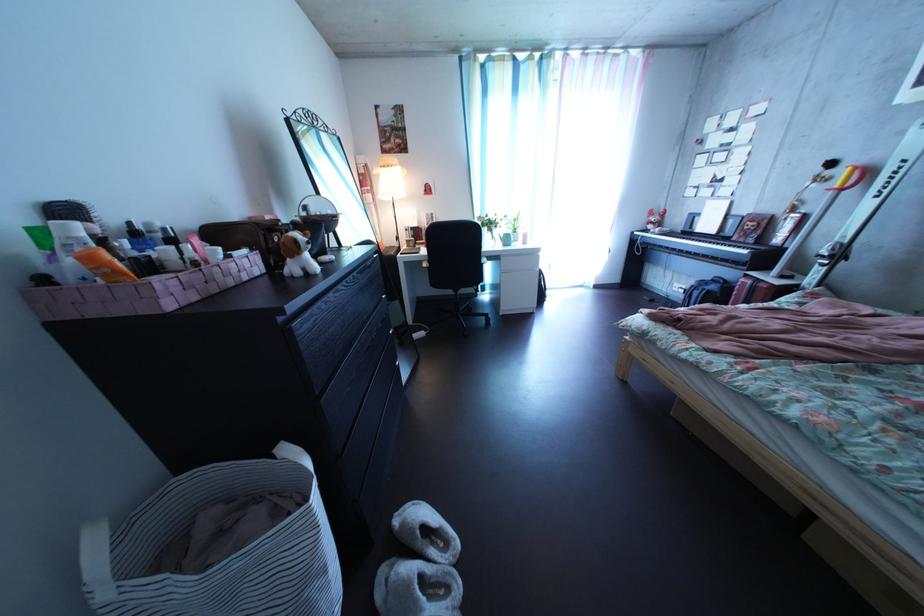
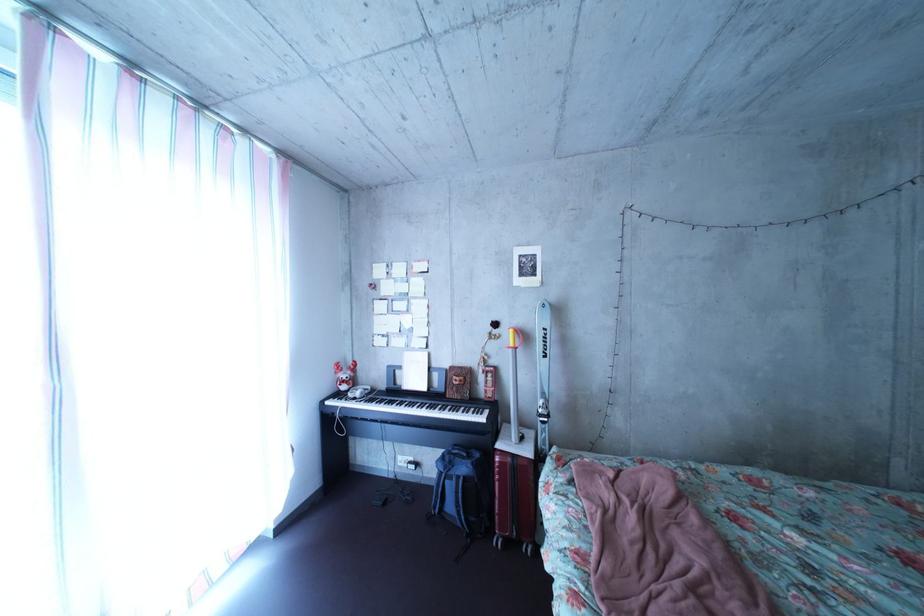
The point at (745, 238) is marked in the first image. Where is the corresponding point in the second image?

(452, 392)